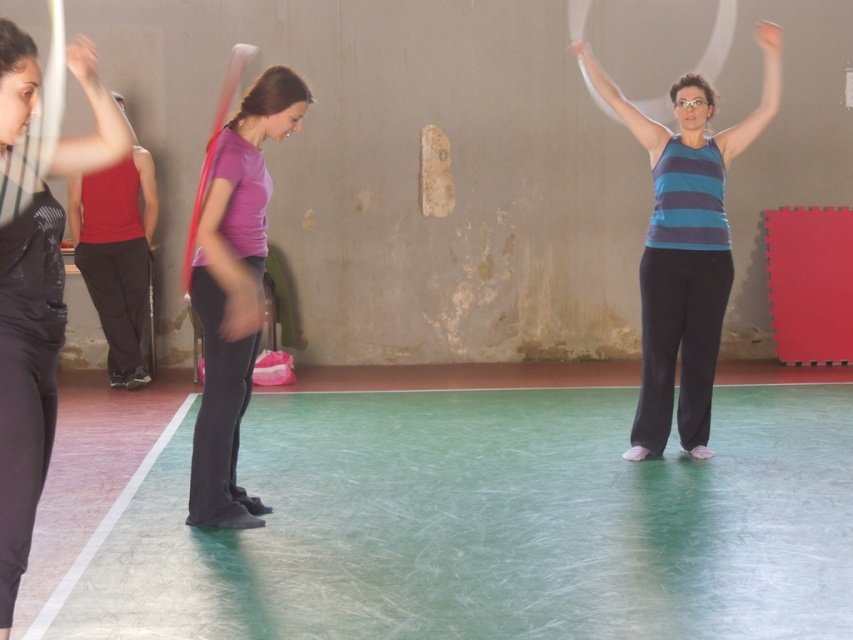
Question: Is purple matte shirt at center behind matte red tank top at left?

Choices:
 (A) yes
 (B) no

Answer: (B)

Question: Which point appears closest to the camera in this image?

Choices:
 (A) (122, 328)
 (B) (53, 376)
 (C) (224, 484)

Answer: (B)

Question: Can you confirm if purple matte shirt at center is positioned to the right of matte red tank top at left?

Choices:
 (A) no
 (B) yes

Answer: (B)

Question: Among these points, which one is farthest from the camera?

Choices:
 (A) (24, 564)
 (B) (134, 156)

Answer: (B)

Question: Which object is positioned farthest from the matte black pants at left?

Choices:
 (A) matte red tank top at left
 (B) purple matte shirt at center
 (C) striped tank top at center

Answer: (A)

Question: Is matte black pants at left behind matte red tank top at left?

Choices:
 (A) no
 (B) yes

Answer: (A)